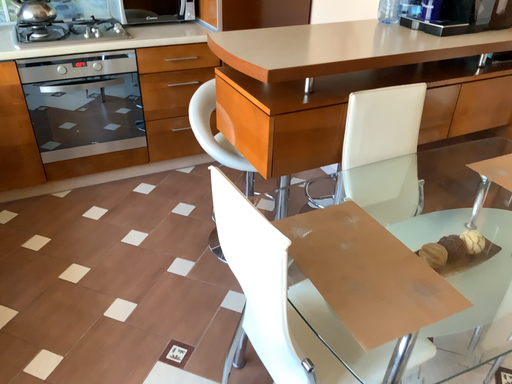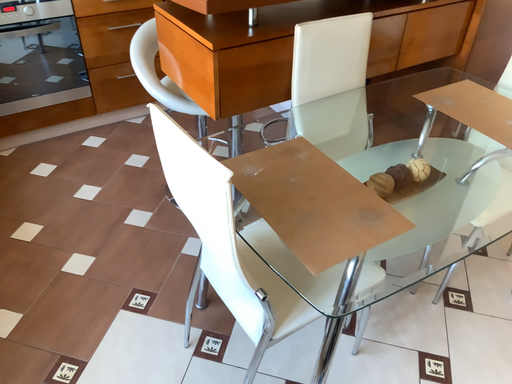
Question: How did the camera likely rotate when shooting the video?

Choices:
 (A) rotated downward
 (B) rotated upward

Answer: (A)